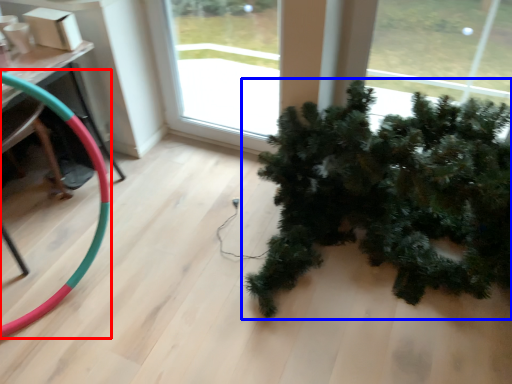
Question: Among these objects, which one is farthest to the camera, garden hose (highlighted by a red box) or houseplant (highlighted by a blue box)?

Choices:
 (A) garden hose
 (B) houseplant

Answer: (A)